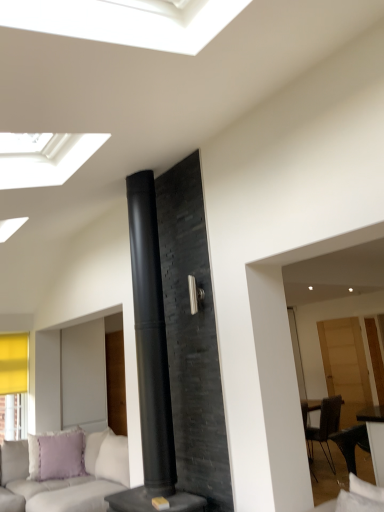
What do you see at coordinates (345, 365) in the screenshot? This screenshot has width=384, height=512. I see `translucent wood door at right` at bounding box center [345, 365].

Identify the location of black matte fireplace at center. This screenshot has height=512, width=384. (191, 338).

Does black matte fireplace at center have a lesser width compared to light gray fabric couch at lower left?

Correct, the width of black matte fireplace at center is less than that of light gray fabric couch at lower left.

Could you tell me if black matte fireplace at center is facing light gray fabric couch at lower left?

No, black matte fireplace at center is not facing towards light gray fabric couch at lower left.

Is black matte fireplace at center bigger than light gray fabric couch at lower left?

Incorrect, black matte fireplace at center is not larger than light gray fabric couch at lower left.

Is black matte fireplace at center taller than light gray fabric couch at lower left?

Yes.

Is translucent wood door at right positioned beyond the bounds of black matte fireplace at center?

Yes, translucent wood door at right is outside of black matte fireplace at center.

From a real-world perspective, which object rests below the other?

translucent wood door at right, from a real-world perspective.

Is translucent wood door at right bigger or smaller than black matte fireplace at center?

Clearly, translucent wood door at right is smaller in size than black matte fireplace at center.

What's the angular difference between translucent wood door at right and black matte fireplace at center's facing directions?

translucent wood door at right and black matte fireplace at center are facing 11.7 degrees away from each other.

Between black matte fireplace at center and translucent wood door at right, which one has larger width?

black matte fireplace at center is wider.

Choose the correct answer: Is black matte fireplace at center inside translucent wood door at right or outside it?

black matte fireplace at center lies outside translucent wood door at right.

What's the angular difference between black matte fireplace at center and translucent wood door at right's facing directions?

There is a 11.7-degree angle between the facing directions of black matte fireplace at center and translucent wood door at right.

From the picture: How much distance is there between black matte fireplace at center and translucent wood door at right?

black matte fireplace at center and translucent wood door at right are 3.61 meters apart from each other.

From a real-world perspective, does translucent wood door at right stand above lavender fabric pillow at lower left?

Yes, from a real-world perspective, translucent wood door at right is above lavender fabric pillow at lower left.

Identify the location of pillow below the translucent wood door at right (from a real-world perspective). The height and width of the screenshot is (512, 384). (56, 455).

Considering the relative sizes of translucent wood door at right and lavender fabric pillow at lower left in the image provided, is translucent wood door at right bigger than lavender fabric pillow at lower left?

Indeed, translucent wood door at right has a larger size compared to lavender fabric pillow at lower left.

Measure the distance between translucent wood door at right and lavender fabric pillow at lower left.

The distance of translucent wood door at right from lavender fabric pillow at lower left is 11.71 feet.

Could you tell me if translucent wood door at right is facing light gray fabric couch at lower left?

No, translucent wood door at right is not aimed at light gray fabric couch at lower left.

Considering the positions of objects translucent wood door at right and light gray fabric couch at lower left in the image provided, who is more to the left, translucent wood door at right or light gray fabric couch at lower left?

From the viewer's perspective, light gray fabric couch at lower left appears more on the left side.

Are translucent wood door at right and light gray fabric couch at lower left located far from each other?

Indeed, translucent wood door at right is not near light gray fabric couch at lower left.

Can you confirm if light gray fabric couch at lower left is bigger than black matte fireplace at center?

Yes, light gray fabric couch at lower left is bigger than black matte fireplace at center.

In the scene shown: How many degrees apart are the facing directions of light gray fabric couch at lower left and black matte fireplace at center?

There is a 89-degree angle between the facing directions of light gray fabric couch at lower left and black matte fireplace at center.

Considering the positions of objects light gray fabric couch at lower left and black matte fireplace at center in the image provided, who is more to the left, light gray fabric couch at lower left or black matte fireplace at center?

From the viewer's perspective, light gray fabric couch at lower left appears more on the left side.

How distant is light gray fabric couch at lower left from black matte fireplace at center?

1.91 meters.

Does light gray fabric couch at lower left have a lesser width compared to translucent wood door at right?

No.

Between light gray fabric couch at lower left and translucent wood door at right, which one has more height?

Standing taller between the two is translucent wood door at right.

Is light gray fabric couch at lower left facing away from translucent wood door at right?

light gray fabric couch at lower left does not have its back to translucent wood door at right.

Can you confirm if light gray fabric couch at lower left is smaller than translucent wood door at right?

Incorrect, light gray fabric couch at lower left is not smaller in size than translucent wood door at right.

In the image, there is a black matte fireplace at center. What are the coordinates of `studio couch below it (from the image's perspective)` in the screenshot? It's located at (65, 477).

At what (x,y) coordinates should I click in order to perform the action: click on fireplace on the left of translucent wood door at right. Please return your answer as a coordinate pair (x, y). The height and width of the screenshot is (512, 384). Looking at the image, I should click on (191, 338).

In the scene shown: From the image, which object appears to be farther from translucent wood door at right, black matte fireplace at center or lavender fabric pillow at lower left?

Based on the image, black matte fireplace at center appears to be further to translucent wood door at right.

Which object lies nearer to the anchor point black matte fireplace at center, lavender fabric pillow at lower left or translucent wood door at right?

Based on the image, lavender fabric pillow at lower left appears to be nearer to black matte fireplace at center.

When comparing their distances from translucent wood door at right, does lavender fabric pillow at lower left or light gray fabric couch at lower left seem closer?

The object closer to translucent wood door at right is light gray fabric couch at lower left.

From the image, which object appears to be nearer to lavender fabric pillow at lower left, black matte fireplace at center or light gray fabric couch at lower left?

light gray fabric couch at lower left is positioned closer to the anchor lavender fabric pillow at lower left.

When comparing their distances from black matte fireplace at center, does lavender fabric pillow at lower left or light gray fabric couch at lower left seem further?

Based on the image, lavender fabric pillow at lower left appears to be further to black matte fireplace at center.

Estimate the real-world distances between objects in this image. Which object is closer to black matte fireplace at center, translucent wood door at right or lavender fabric pillow at lower left?

Based on the image, lavender fabric pillow at lower left appears to be nearer to black matte fireplace at center.

Based on the photo, which object lies nearer to the anchor point translucent wood door at right, lavender fabric pillow at lower left or black matte fireplace at center?

lavender fabric pillow at lower left is closer to translucent wood door at right.

Based on their spatial positions, is translucent wood door at right or light gray fabric couch at lower left closer to black matte fireplace at center?

light gray fabric couch at lower left is closer to black matte fireplace at center.

Locate an element on the screen. This screenshot has width=384, height=512. studio couch located between lavender fabric pillow at lower left and translucent wood door at right in the left-right direction is located at coordinates (65, 477).

The image size is (384, 512). In order to click on studio couch located between black matte fireplace at center and lavender fabric pillow at lower left in the depth direction in this screenshot , I will do `click(65, 477)`.

Locate an element on the screen. This screenshot has height=512, width=384. studio couch located between black matte fireplace at center and translucent wood door at right in the depth direction is located at coordinates (65, 477).

The width and height of the screenshot is (384, 512). I want to click on pillow between black matte fireplace at center and translucent wood door at right along the z-axis, so click(x=56, y=455).